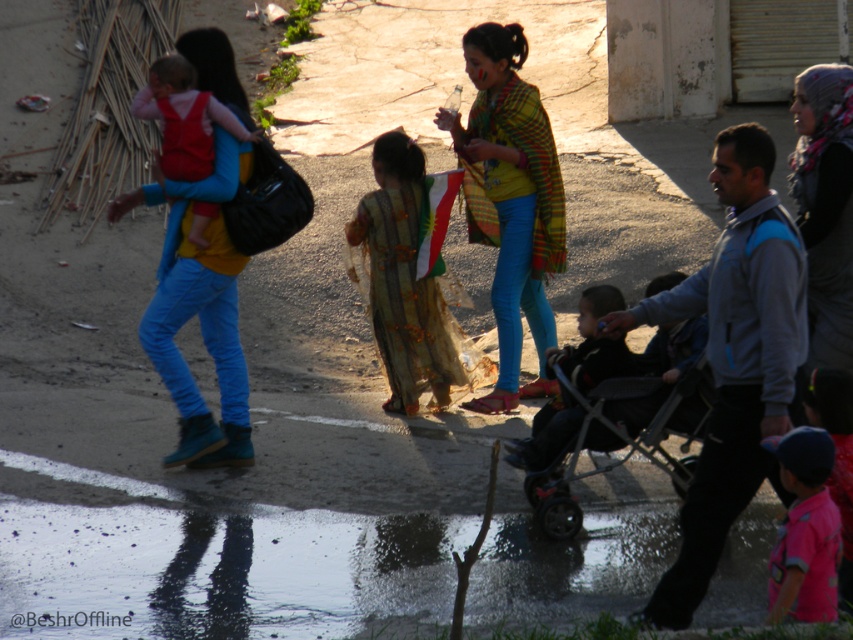
You are standing at the point labeled as point (793, 556) and want to walk to the point labeled as point (175, 380). Given that both points are on the same path, which direction should you move relative to your current position?

You should move forward because point (175, 380) is behind point (793, 556), meaning it is in the direction you are facing if you continue moving straight ahead.

You are standing at the point labeled point (161, 356) and want to walk towards the point labeled point (498, 257). Based on the scene description, will you be moving towards the foreground or background of the image?

→ The point labeled point (498, 257) is behind point labeled point (161, 356). Therefore, walking towards point (498, 257) would mean moving towards the background of the image.